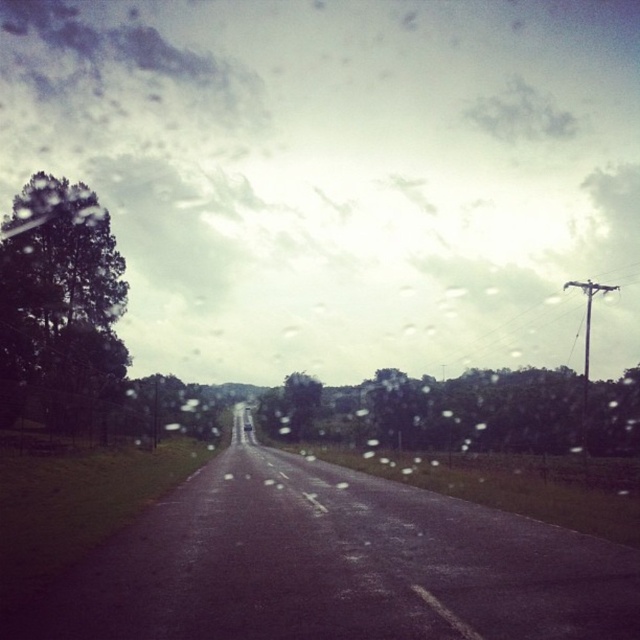
Question: Considering the relative positions of cloudy sky at upper center and metallic silver sedan at center in the image provided, where is cloudy sky at upper center located with respect to metallic silver sedan at center?

Choices:
 (A) above
 (B) below

Answer: (A)

Question: Is cloudy sky at upper center thinner than metallic silver sedan at center?

Choices:
 (A) no
 (B) yes

Answer: (A)

Question: Which object is farther from the camera taking this photo?

Choices:
 (A) cloudy sky at upper center
 (B) metallic silver sedan at center

Answer: (B)

Question: Does cloudy sky at upper center come in front of metallic silver sedan at center?

Choices:
 (A) no
 (B) yes

Answer: (B)

Question: Which object appears closest to the camera in this image?

Choices:
 (A) cloudy sky at upper center
 (B) metallic silver sedan at center

Answer: (A)

Question: Which point is closer to the camera?

Choices:
 (A) (589, 198)
 (B) (243, 426)

Answer: (B)